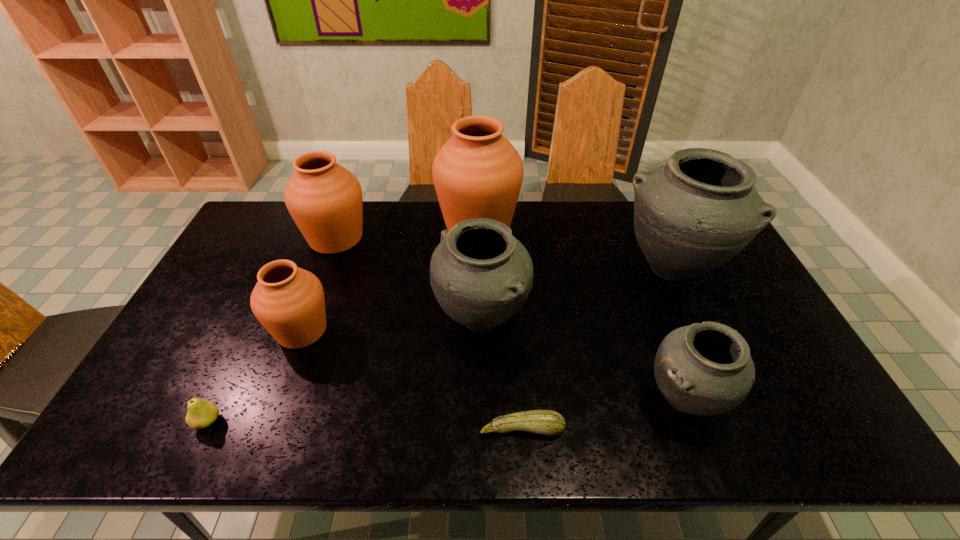
The height and width of the screenshot is (540, 960). Find the location of `object that is positioned at the right edge`. object that is positioned at the right edge is located at coordinates (691, 215).

The width and height of the screenshot is (960, 540). Identify the location of object positioned at the far right corner. (691, 215).

At what (x,y) coordinates should I click in order to perform the action: click on free region at the far edge of the desktop. Please return your answer as a coordinate pair (x, y). The width and height of the screenshot is (960, 540). Looking at the image, I should click on (520, 221).

The height and width of the screenshot is (540, 960). In the image, there is a desktop. Identify the location of vacant space at the near edge. [x=224, y=424].

Locate an element on the screen. The height and width of the screenshot is (540, 960). free region at the left edge is located at coordinates (207, 355).

In the image, there is a desktop. In order to click on vacant space at the right edge in this screenshot , I will do `click(739, 271)`.

At what (x,y) coordinates should I click in order to perform the action: click on free space at the far left corner. Please return your answer as a coordinate pair (x, y). Looking at the image, I should click on (257, 233).

Locate an element on the screen. The width and height of the screenshot is (960, 540). free space at the near left corner of the desktop is located at coordinates (168, 425).

Find the location of a particular element. free space between the smallest brown urn and the leftmost black urn is located at coordinates (392, 325).

At what (x,y) coordinates should I click in order to perform the action: click on free space between the biggest brown urn and the biggest black urn. Please return your answer as a coordinate pair (x, y). This screenshot has width=960, height=540. Looking at the image, I should click on (575, 247).